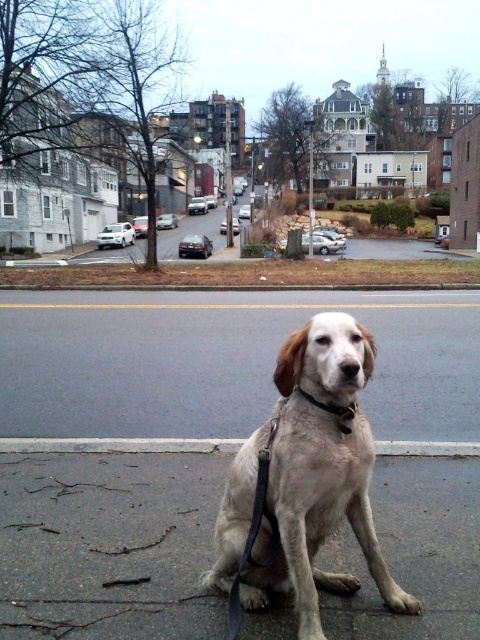
Question: Observing the image, what is the correct spatial positioning of gray asphalt pavement at lower center in reference to gray asphalt at center?

Choices:
 (A) below
 (B) above

Answer: (A)

Question: Which of these objects is positioned farthest from the gray asphalt at center?

Choices:
 (A) gray asphalt pavement at lower center
 (B) gray concrete curb at lower center

Answer: (A)

Question: Can you confirm if light brown fur dog at center is positioned to the left of black leather neckband at center?

Choices:
 (A) no
 (B) yes

Answer: (B)

Question: From the image, what is the correct spatial relationship of gray asphalt at center in relation to light brown fur dog at center?

Choices:
 (A) below
 (B) above

Answer: (B)

Question: Based on their relative distances, which object is farther from the gray concrete curb at lower center?

Choices:
 (A) light brown fur dog at center
 (B) gray asphalt pavement at lower center
 (C) black leather neckband at center

Answer: (C)

Question: Based on their relative distances, which object is nearer to the light brown fur dog at center?

Choices:
 (A) black leather neckband at center
 (B) gray asphalt at center
 (C) gray concrete curb at lower center
 (D) gray asphalt pavement at lower center

Answer: (A)